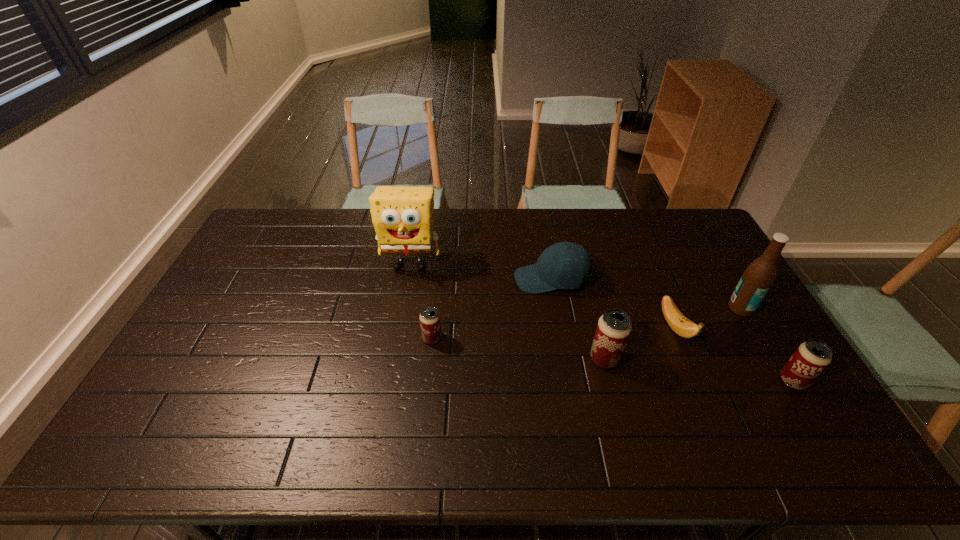
The height and width of the screenshot is (540, 960). Identify the location of object that is at the near right corner. (811, 358).

Find the location of a particular element. vacant region at the far edge of the desktop is located at coordinates (308, 210).

Image resolution: width=960 pixels, height=540 pixels. Identify the location of vacant space at the near edge. (693, 395).

You are a GUI agent. You are given a task and a screenshot of the screen. Output one action in this format:
    pyautogui.click(x=<x>, y=<y>)
    Task: Click on the vacant area at the left edge
    This screenshot has width=960, height=540.
    Given the screenshot: What is the action you would take?
    pyautogui.click(x=204, y=324)

Image resolution: width=960 pixels, height=540 pixels. In the image, there is a desktop. Identify the location of vacant space at the right edge. (757, 363).

Where is `vacant space at the near right corner of the desktop`? vacant space at the near right corner of the desktop is located at coordinates (822, 415).

The width and height of the screenshot is (960, 540). What are the coordinates of `vacant area that lies between the baseball cap and the beer bottle` in the screenshot? It's located at coord(646,294).

Locate an element on the screen. This screenshot has width=960, height=540. vacant space in between the baseball cap and the rightmost beer can is located at coordinates (672, 330).

At what (x,y) coordinates should I click in order to perform the action: click on free space between the shortest beer can and the banana. Please return your answer as a coordinate pair (x, y). Looking at the image, I should click on (554, 333).

Identify the location of free point between the tallest beer can and the banana. (640, 343).